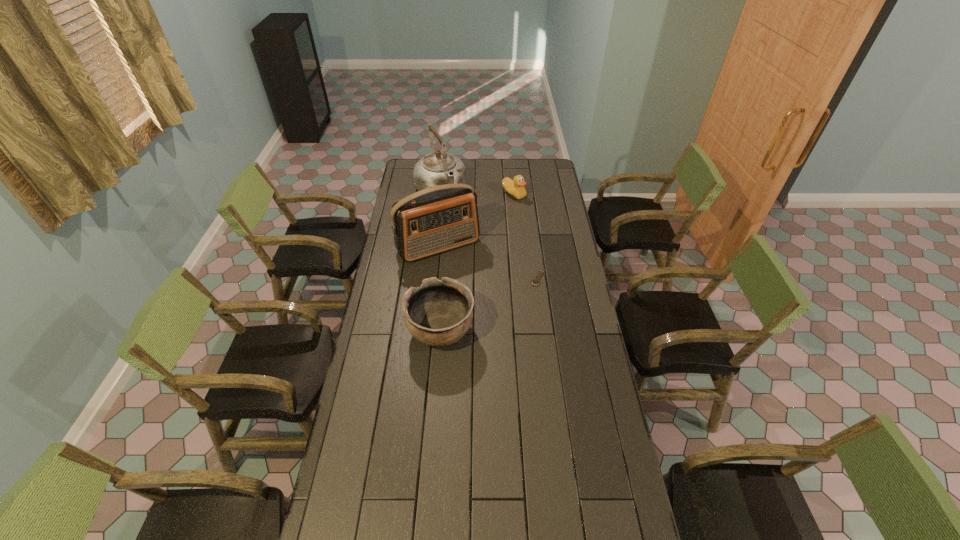
Where is `the third shortest object`? The height and width of the screenshot is (540, 960). the third shortest object is located at coordinates (438, 313).

This screenshot has height=540, width=960. I want to click on the nearest object, so click(x=438, y=313).

Where is `watch`? The width and height of the screenshot is (960, 540). watch is located at coordinates (535, 282).

Identify the location of the second nearest object. (535, 282).

You are a GUI agent. You are given a task and a screenshot of the screen. Output one action in this format:
    pyautogui.click(x=<x>, y=<y>)
    Task: Click on the third nearest object
    This screenshot has width=960, height=540.
    Given the screenshot: What is the action you would take?
    pyautogui.click(x=436, y=219)

The height and width of the screenshot is (540, 960). I want to click on kettle, so click(x=437, y=168).

At what (x,y) coordinates should I click in order to perform the action: click on duck. Please return your answer as a coordinate pair (x, y). This screenshot has height=540, width=960. Looking at the image, I should click on (515, 187).

Locate an element on the screen. free spot located 0.080m on the front of the nearest object is located at coordinates coord(438,377).

In order to click on vacant area located 0.220m on the front of the shortest object in this screenshot , I will do `click(545, 325)`.

Where is `free space located 0.240m on the front-facing side of the radio receiver`? This screenshot has height=540, width=960. free space located 0.240m on the front-facing side of the radio receiver is located at coordinates (476, 298).